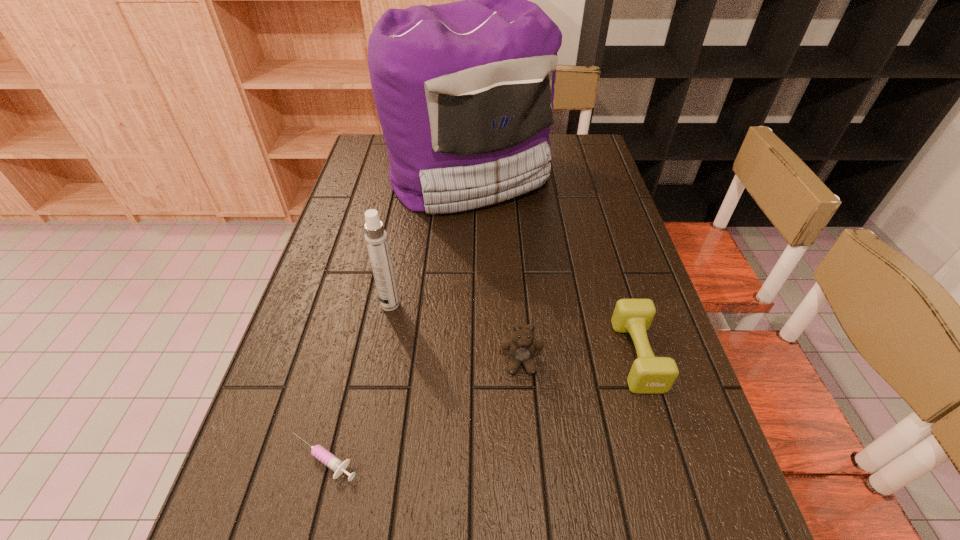
Identify which object is the closest to the fourth tallest object. Please provide its 2D coordinates. Your answer should be formatted as a tuple, i.e. [(x, y)], where the tuple contains the x and y coordinates of a point satisfying the conditions above.

[(522, 346)]

The image size is (960, 540). Find the location of `object that stands as the third closest to the third shortest object`. object that stands as the third closest to the third shortest object is located at coordinates (319, 452).

In order to click on free spot that satisfies the following two spatial constraints: 1. on the front pocket of the dumbbell; 2. on the right side of the tallest object in this screenshot , I will do `click(464, 356)`.